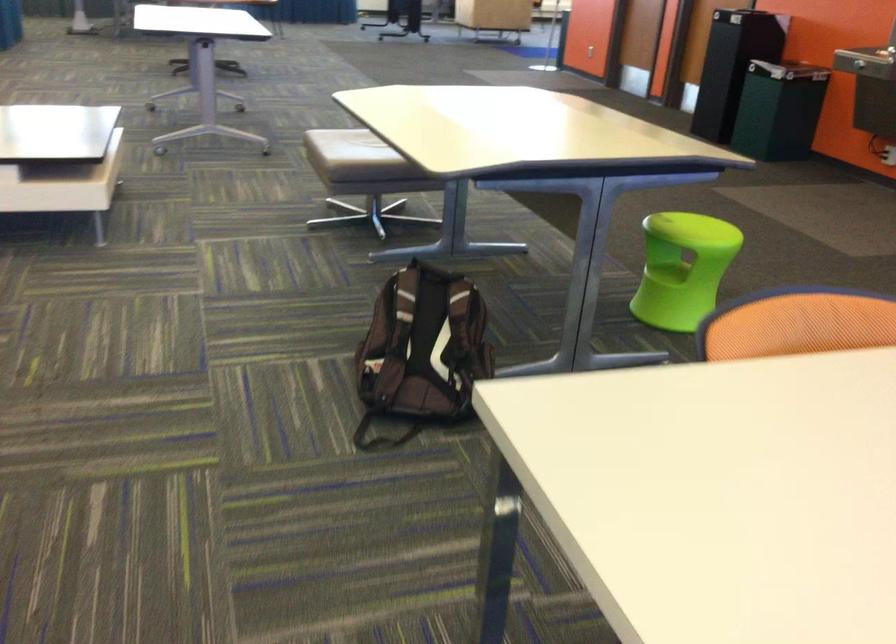
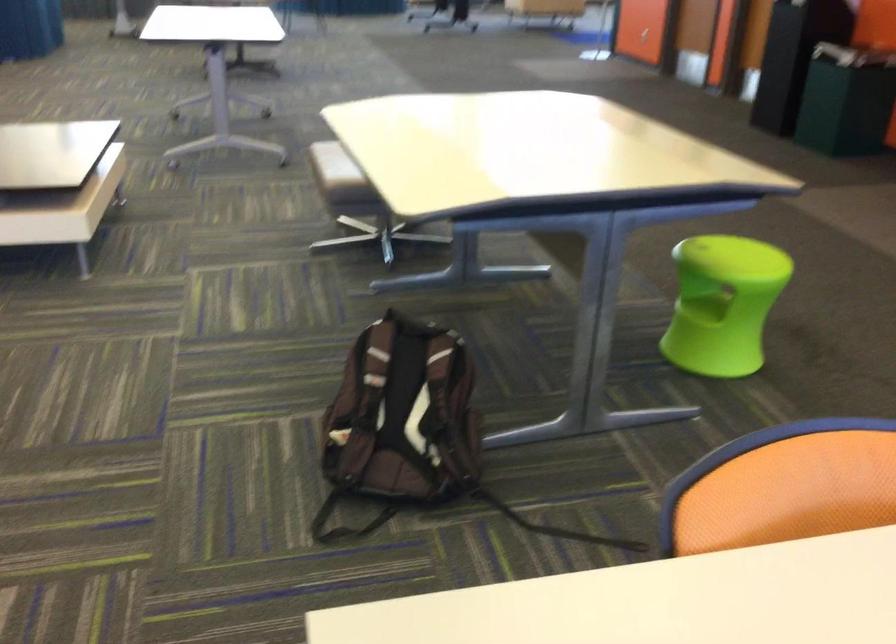
Find the pixel in the second image that matches point (659, 275) in the first image.

(702, 307)